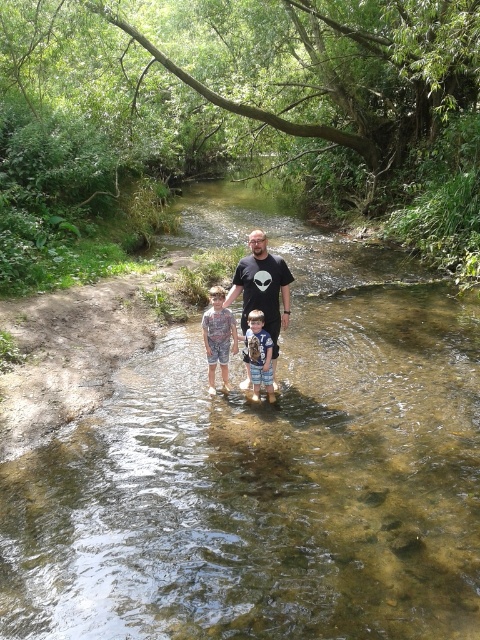
You are planning to cross the stream and need to choose between two pairs of shorts available in your backpack. The camouflage shorts at center and the light blue denim shorts at center. Which pair would be more suitable for wading through the stream based on their sizes?

The camouflage shorts at center are larger in size than the light blue denim shorts at center, so they would be more suitable for wading through the stream as they provide better coverage and comfort in the water.